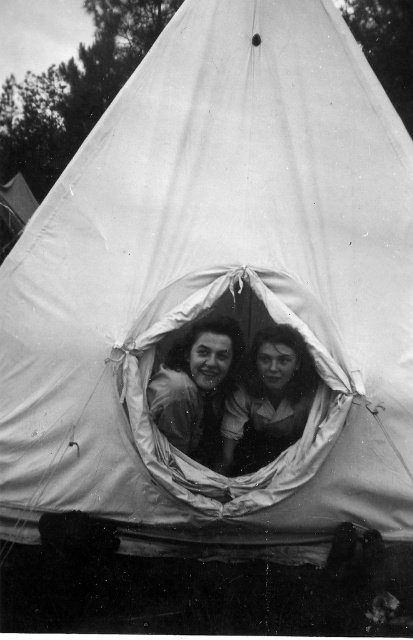
You are a photographer reviewing this image. You notice two faces at the center of the tent opening. Which face is closer to the camera, the smooth skin face at center or the smooth fabric face at center?

The smooth skin face at center is positioned over smooth fabric face at center, so the smooth skin face at center is closer to the camera.

What are the coordinates of the smooth skin face at center in the image?

The smooth skin face at center is located at coordinates point (197, 387).

You are a photographer reviewing this black and white photo of a tent with two people. You notice two faces at the center opening. Which face, the smooth skin face at center or the smooth fabric face at center, appears smaller in the photo?

The smooth skin face at center is smaller than the smooth fabric face at center in the photo.